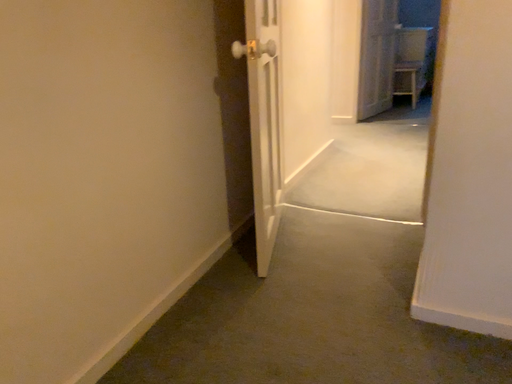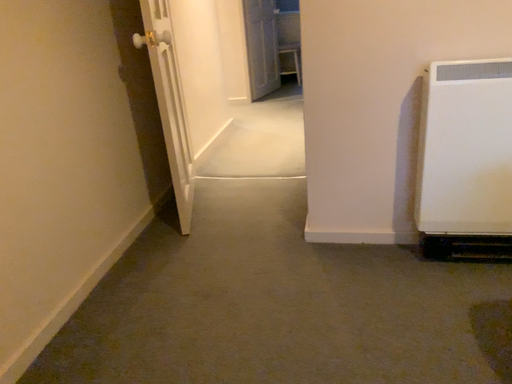
Question: Which way did the camera rotate in the video?

Choices:
 (A) rotated right
 (B) rotated left

Answer: (A)